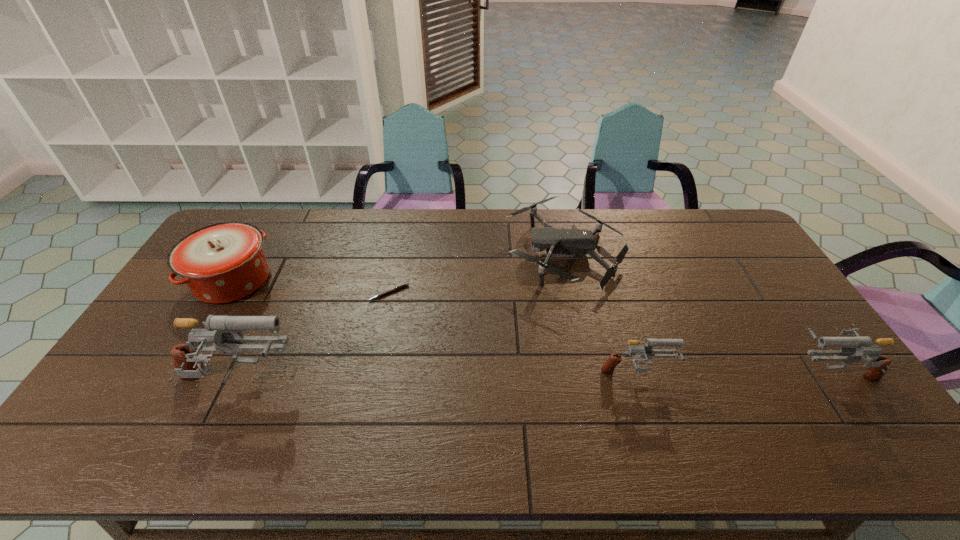
I want to click on object positioned at the far edge, so click(556, 241).

Image resolution: width=960 pixels, height=540 pixels. Find the location of `object that is at the left edge`. object that is at the left edge is located at coordinates (225, 262).

Where is `object positioned at the right edge`? This screenshot has width=960, height=540. object positioned at the right edge is located at coordinates (878, 366).

Identify the location of object that is positioned at the near right corner. (878, 366).

Image resolution: width=960 pixels, height=540 pixels. What are the coordinates of `free space at the far edge of the desktop` in the screenshot? It's located at (392, 231).

In the image, there is a desktop. In order to click on vacant space at the near edge in this screenshot , I will do `click(230, 390)`.

In the image, there is a desktop. Identify the location of free space at the left edge. This screenshot has width=960, height=540. (118, 381).

Find the location of a particular element. The image size is (960, 540). free region at the right edge is located at coordinates (765, 294).

In the image, there is a desktop. What are the coordinates of `vacant space at the near left corner` in the screenshot? It's located at (140, 399).

Where is `free space at the far right corner of the desktop`? free space at the far right corner of the desktop is located at coordinates (693, 219).